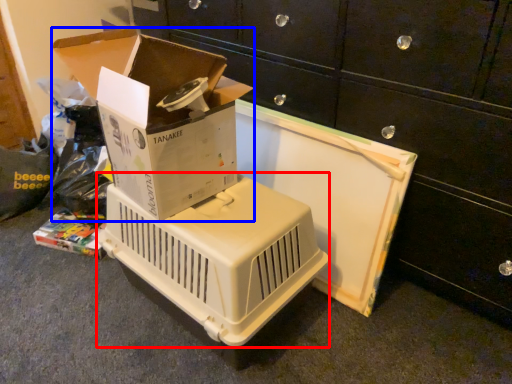
Question: Which object appears closest to the camera in this image, appliance (highlighted by a red box) or box (highlighted by a blue box)?

Choices:
 (A) appliance
 (B) box

Answer: (B)